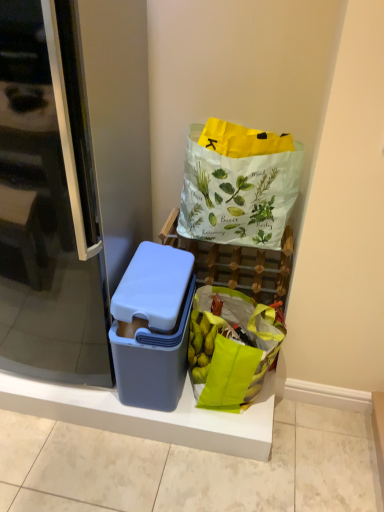
Find the location of a particular element. The width and height of the screenshot is (384, 512). matte plastic container at left is located at coordinates (148, 415).

Find the location of a particular element. This screenshot has width=384, height=512. white paper bag with green leaf illustrations at upper right is located at coordinates (238, 185).

What is the approximate height of matte plastic lunch box at center?

matte plastic lunch box at center is 19.83 inches tall.

Where is `green fabric grocery bag at lower right`? The height and width of the screenshot is (512, 384). green fabric grocery bag at lower right is located at coordinates (x=231, y=348).

Which is behind, green fabric grocery bag at lower right or transparent plastic container at left?

green fabric grocery bag at lower right is behind.

Considering the relative sizes of green fabric grocery bag at lower right and transparent plastic container at left in the image provided, is green fabric grocery bag at lower right bigger than transparent plastic container at left?

Actually, green fabric grocery bag at lower right might be smaller than transparent plastic container at left.

Is green fabric grocery bag at lower right positioned with its back to transparent plastic container at left?

green fabric grocery bag at lower right does not have its back to transparent plastic container at left.

Is transparent plastic container at left a part of green fabric grocery bag at lower right?

No, transparent plastic container at left is located outside of green fabric grocery bag at lower right.

This screenshot has height=512, width=384. I want to click on grocery bag on the right of transparent plastic container at left, so click(x=231, y=348).

From the image's perspective, would you say transparent plastic container at left is shown under green fabric grocery bag at lower right?

No.

Is transparent plastic container at left looking in the opposite direction of green fabric grocery bag at lower right?

transparent plastic container at left does not have its back to green fabric grocery bag at lower right.

Does transparent plastic container at left have a lesser width compared to green fabric grocery bag at lower right?

No.

In the image, is matte plastic container at left positioned in front of or behind green fabric grocery bag at lower right?

Visually, matte plastic container at left is located behind green fabric grocery bag at lower right.

Is matte plastic container at left situated inside green fabric grocery bag at lower right or outside?

matte plastic container at left cannot be found inside green fabric grocery bag at lower right.

From the image's perspective, is matte plastic container at left located above green fabric grocery bag at lower right?

No.

Is matte plastic container at left far from green fabric grocery bag at lower right?

Actually, matte plastic container at left and green fabric grocery bag at lower right are a little close together.

Does point (277, 161) appear closer or farther from the camera than point (28, 38)?

Clearly, point (277, 161) is more distant from the camera than point (28, 38).

Which is more to the left, white paper bag with green leaf illustrations at upper right or transparent plastic container at left?

transparent plastic container at left.

Which of these two, white paper bag with green leaf illustrations at upper right or transparent plastic container at left, is wider?

With larger width is transparent plastic container at left.

Are white paper bag with green leaf illustrations at upper right and transparent plastic container at left far apart?

No, white paper bag with green leaf illustrations at upper right is in close proximity to transparent plastic container at left.

Considering the relative sizes of green fabric grocery bag at lower right and matte plastic basket at center in the image provided, is green fabric grocery bag at lower right thinner than matte plastic basket at center?

No, green fabric grocery bag at lower right is not thinner than matte plastic basket at center.

Is green fabric grocery bag at lower right taller or shorter than matte plastic basket at center?

Considering their sizes, green fabric grocery bag at lower right has less height than matte plastic basket at center.

How different are the orientations of green fabric grocery bag at lower right and matte plastic basket at center in degrees?

0.000658 degrees separate the facing orientations of green fabric grocery bag at lower right and matte plastic basket at center.

I want to click on grocery bag on the right of matte plastic basket at center, so click(x=231, y=348).

In the scene shown: Can you tell me how much green fabric grocery bag at lower right and matte plastic container at left differ in facing direction?

The angular difference between green fabric grocery bag at lower right and matte plastic container at left is 0.000896 degrees.

From the image's perspective, would you say green fabric grocery bag at lower right is shown under matte plastic container at left?

No, from the image's perspective, green fabric grocery bag at lower right is not beneath matte plastic container at left.

Is green fabric grocery bag at lower right facing towards matte plastic container at left?

No, green fabric grocery bag at lower right is not facing towards matte plastic container at left.

From a real-world perspective, between green fabric grocery bag at lower right and matte plastic container at left, who is vertically lower?

matte plastic container at left is physically lower.

Which of these two, white paper bag with green leaf illustrations at upper right or green fabric grocery bag at lower right, is bigger?

With larger size is white paper bag with green leaf illustrations at upper right.

From their relative heights in the image, would you say white paper bag with green leaf illustrations at upper right is taller or shorter than green fabric grocery bag at lower right?

Considering their sizes, white paper bag with green leaf illustrations at upper right has more height than green fabric grocery bag at lower right.

From the image's perspective, is white paper bag with green leaf illustrations at upper right on top of green fabric grocery bag at lower right?

Correct, white paper bag with green leaf illustrations at upper right appears higher than green fabric grocery bag at lower right in the image.

Looking at this image, would you consider white paper bag with green leaf illustrations at upper right to be distant from green fabric grocery bag at lower right?

white paper bag with green leaf illustrations at upper right is actually quite close to green fabric grocery bag at lower right.

This screenshot has height=512, width=384. I want to click on grocery bag directly beneath the transparent plastic container at left (from a real-world perspective), so click(231, 348).

Find the location of a particular element. The height and width of the screenshot is (512, 384). grocery bag below the transparent plastic container at left (from the image's perspective) is located at coordinates (231, 348).

From the image, which object appears to be nearer to matte plastic lunch box at center, green fabric grocery bag at lower right or transparent plastic container at left?

green fabric grocery bag at lower right is positioned closer to the anchor matte plastic lunch box at center.

Based on their spatial positions, is white paper bag with green leaf illustrations at upper right or matte plastic basket at center closer to transparent plastic container at left?

The object closer to transparent plastic container at left is white paper bag with green leaf illustrations at upper right.

Considering their positions, is transparent plastic container at left positioned further to green fabric grocery bag at lower right than white paper bag with green leaf illustrations at upper right?

transparent plastic container at left.

From the image, which object appears to be farther from white paper bag with green leaf illustrations at upper right, transparent plastic container at left or matte plastic lunch box at center?

transparent plastic container at left lies further to white paper bag with green leaf illustrations at upper right than the other object.

Based on the photo, looking at the image, which one is located further to matte plastic basket at center, matte plastic lunch box at center or transparent plastic container at left?

transparent plastic container at left is further to matte plastic basket at center.

When comparing their distances from white paper bag with green leaf illustrations at upper right, does green fabric grocery bag at lower right or matte plastic container at left seem further?

Answer: The object further to white paper bag with green leaf illustrations at upper right is matte plastic container at left.

Looking at the image, which one is located further to matte plastic container at left, white paper bag with green leaf illustrations at upper right or green fabric grocery bag at lower right?

The object further to matte plastic container at left is white paper bag with green leaf illustrations at upper right.

Estimate the real-world distances between objects in this image. Which object is closer to green fabric grocery bag at lower right, transparent plastic container at left or matte plastic lunch box at center?

matte plastic lunch box at center.

Identify the location of shelf situated between transparent plastic container at left and white paper bag with green leaf illustrations at upper right from left to right. The image size is (384, 512). (237, 263).

Locate an element on the screen. The image size is (384, 512). grocery bag located between transparent plastic container at left and white paper bag with green leaf illustrations at upper right in the left-right direction is located at coordinates (231, 348).

The width and height of the screenshot is (384, 512). What are the coordinates of `lunch box between white paper bag with green leaf illustrations at upper right and green fabric grocery bag at lower right in the vertical direction` in the screenshot? It's located at (153, 326).

What are the coordinates of `shelf that lies between white paper bag with green leaf illustrations at upper right and green fabric grocery bag at lower right from top to bottom` in the screenshot? It's located at (237, 263).